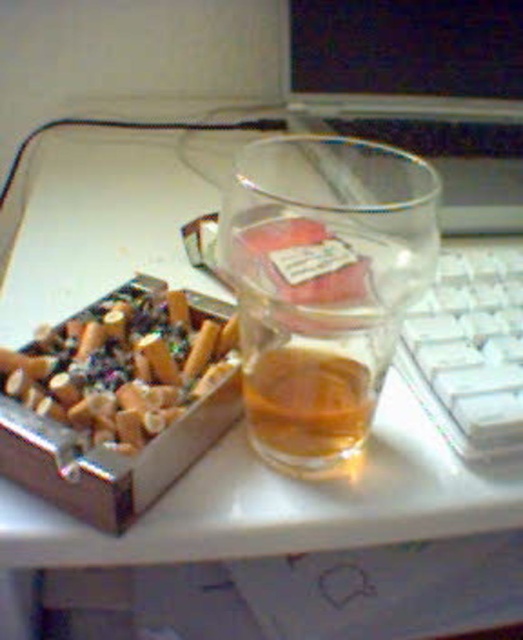
Question: Observing the image, what is the correct spatial positioning of transparent glass at center in reference to translucent glass at center?

Choices:
 (A) right
 (B) left

Answer: (A)

Question: Which object is the farthest from the metallic ashtray at left?

Choices:
 (A) transparent glass at center
 (B) translucent glass at center
 (C) white plastic keyboard at right

Answer: (C)

Question: Does transparent glass at center appear on the left side of white plastic keyboard at right?

Choices:
 (A) no
 (B) yes

Answer: (B)

Question: Which object is the closest to the metallic ashtray at left?

Choices:
 (A) white plastic keyboard at right
 (B) translucent glass at center
 (C) transparent glass at center

Answer: (B)

Question: Is transparent glass at center above metallic ashtray at left?

Choices:
 (A) yes
 (B) no

Answer: (A)

Question: Based on their relative distances, which object is farther from the white plastic keyboard at right?

Choices:
 (A) translucent glass at center
 (B) transparent glass at center

Answer: (A)